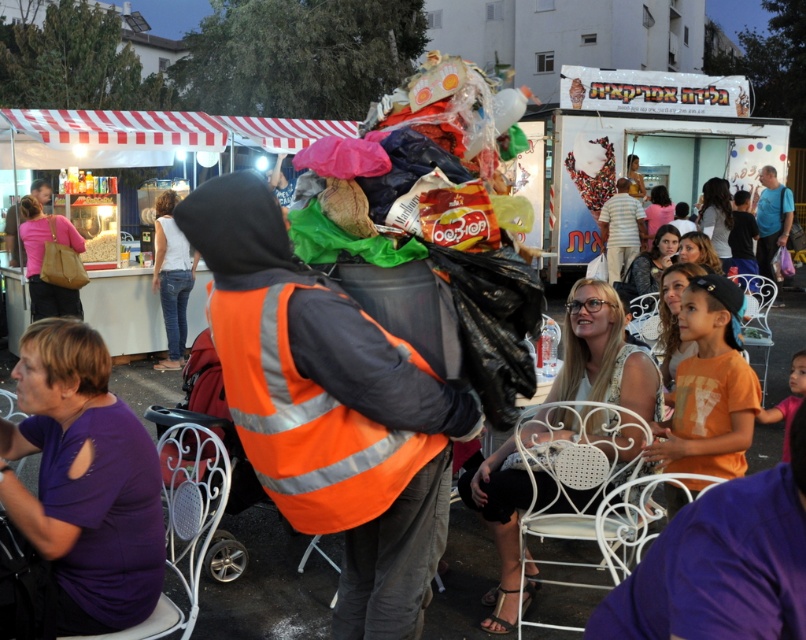
You are a customer at the fair who wants to order a meal from the white cardboard food truck at center. You are standing at the striped cotton shirt at center. Can you reach the food truck without stepping over anything?

The white cardboard food truck at center is positioned over striped cotton shirt at center, so you cannot reach the food truck without stepping over the striped cotton shirt at center.